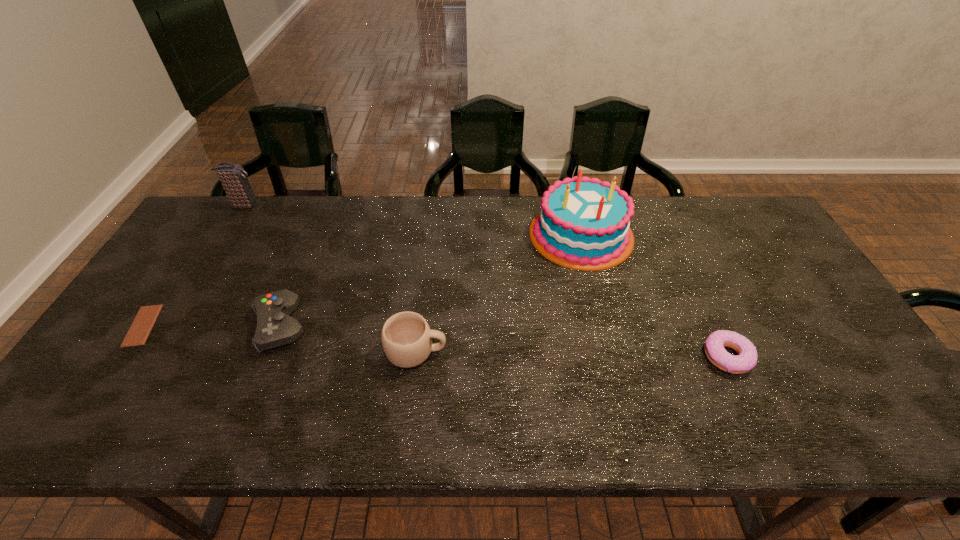
You are a GUI agent. You are given a task and a screenshot of the screen. Output one action in this format:
    pyautogui.click(x=<x>, y=<y>)
    Task: Click on the tallest object
    
    Given the screenshot: What is the action you would take?
    pyautogui.click(x=583, y=224)

The image size is (960, 540). I want to click on birthday cake, so click(583, 224).

Locate an element on the screen. Image resolution: width=960 pixels, height=540 pixels. the fifth shortest object is located at coordinates (233, 177).

At what (x,y) coordinates should I click in order to perform the action: click on the third object from right to left. Please return your answer as a coordinate pair (x, y). The width and height of the screenshot is (960, 540). Looking at the image, I should click on (406, 338).

Locate an element on the screen. The height and width of the screenshot is (540, 960). mug is located at coordinates (406, 338).

This screenshot has height=540, width=960. Identify the location of the third object from left to right. (275, 327).

This screenshot has height=540, width=960. What are the coordinates of `the third shortest object` in the screenshot? It's located at (275, 327).

This screenshot has height=540, width=960. Identify the location of the second shortest object. (746, 359).

Locate an element on the screen. The height and width of the screenshot is (540, 960). the rightmost object is located at coordinates (746, 359).

Identify the location of the shortest object. (144, 321).